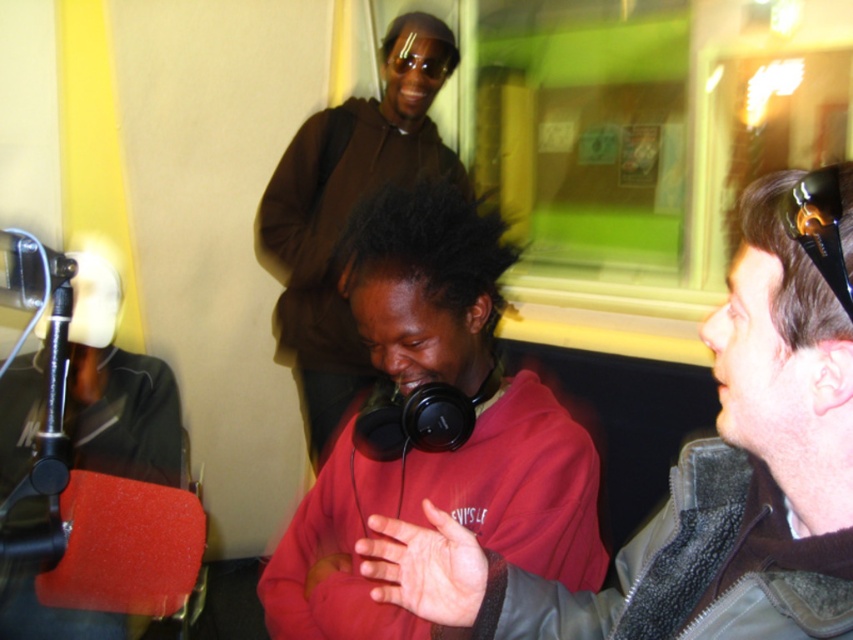
Is brown matte jacket at upper center thinner than rubberized black microphone at left?

No.

What are the coordinates of `brown matte jacket at upper center` in the screenshot? It's located at (347, 212).

This screenshot has width=853, height=640. Find the location of `brown matte jacket at upper center`. brown matte jacket at upper center is located at coordinates (347, 212).

In the scene shown: Who is taller, matte red hoodie at center or brown matte jacket at upper center?

brown matte jacket at upper center is taller.

Is matte red hoodie at center further to camera compared to brown matte jacket at upper center?

No.

Is point (526, 433) positioned behind point (418, 92)?

No, (526, 433) is closer to viewer.

The height and width of the screenshot is (640, 853). What are the coordinates of `matte red hoodie at center` in the screenshot? It's located at (444, 509).

Can you confirm if matte red hoodie at center is positioned to the left of rubberized black microphone at left?

No, matte red hoodie at center is not to the left of rubberized black microphone at left.

Between matte red hoodie at center and rubberized black microphone at left, which one appears on the left side from the viewer's perspective?

rubberized black microphone at left

The height and width of the screenshot is (640, 853). I want to click on matte red hoodie at center, so click(x=444, y=509).